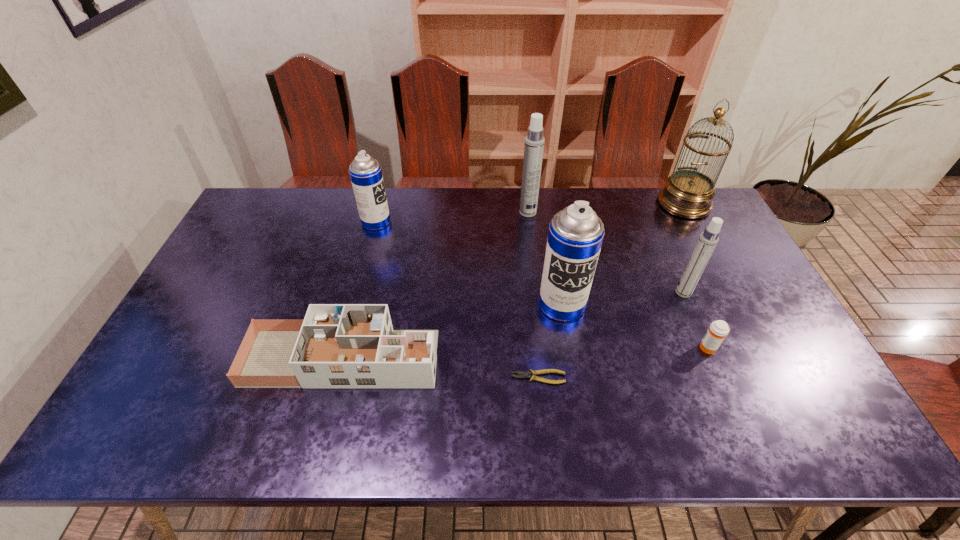
At what (x,y) coordinates should I click in order to perform the action: click on free space that is in between the bigger white aerosol can and the shortest object. Please return your answer as a coordinate pair (x, y). The width and height of the screenshot is (960, 540). Looking at the image, I should click on (533, 295).

This screenshot has width=960, height=540. What are the coordinates of `free area in between the left white aerosol can and the rightmost object` in the screenshot? It's located at pyautogui.click(x=606, y=208).

Find the location of a particular element. This screenshot has height=540, width=960. vacant area that lies between the yellow pliers and the golden birdcage is located at coordinates (611, 291).

Identify the location of vacant space in between the dollhouse and the medicine. The height and width of the screenshot is (540, 960). (526, 353).

Find the location of a particular element. vacant point located between the left blue aerosol can and the dollhouse is located at coordinates (359, 290).

Find the location of `blank region between the smaller white aerosol can and the smaller blue aerosol can`. blank region between the smaller white aerosol can and the smaller blue aerosol can is located at coordinates (530, 257).

This screenshot has width=960, height=540. Identify the location of free space between the left blue aerosol can and the dollhouse. (359, 290).

The image size is (960, 540). Identify the location of object that is the sixth nearest to the dollhouse. (708, 239).

Locate which object ranks in proximity to the farther white aerosol can. Please provide its 2D coordinates. Your answer should be formatted as a tuple, i.e. [(x, y)], where the tuple contains the x and y coordinates of a point satisfying the conditions above.

[(576, 233)]

Locate an element on the screen. This screenshot has height=540, width=960. aerosol can that is the third closest to the smaller blue aerosol can is located at coordinates (708, 239).